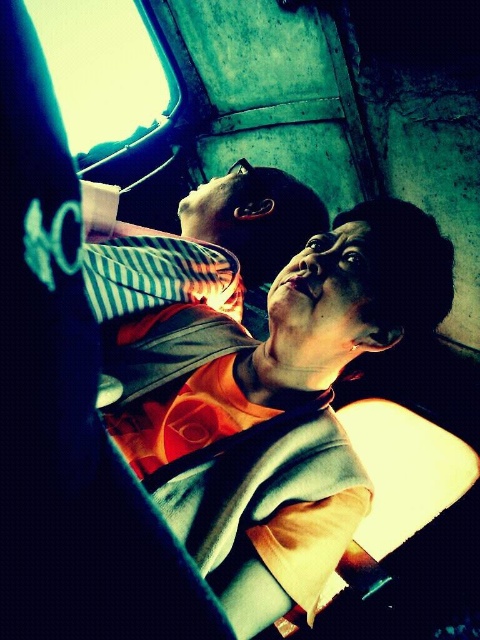
Which is below, striped fabric pillow at upper center or transparent glass window at upper left?

Positioned lower is striped fabric pillow at upper center.

How far apart are striped fabric pillow at upper center and transparent glass window at upper left?

A distance of 9.75 feet exists between striped fabric pillow at upper center and transparent glass window at upper left.

Does point (226, 285) lie behind point (69, 109)?

No.

The image size is (480, 640). I want to click on striped fabric pillow at upper center, so click(x=205, y=244).